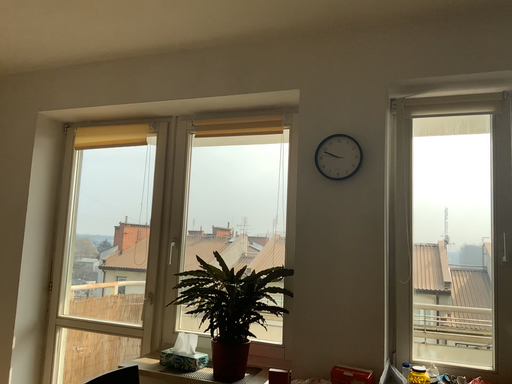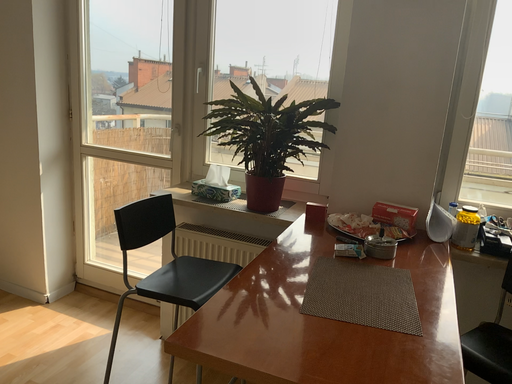
Question: How did the camera likely rotate when shooting the video?

Choices:
 (A) rotated downward
 (B) rotated upward

Answer: (A)